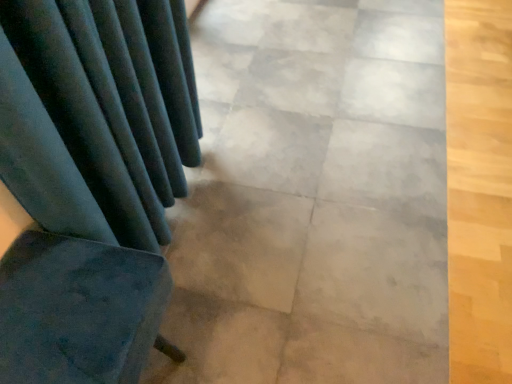
Measure the distance between gray concrete at center and camera.

gray concrete at center and camera are 1.16 meters apart from each other.

Describe the element at coordinates (314, 198) in the screenshot. I see `gray concrete at center` at that location.

This screenshot has height=384, width=512. I want to click on gray concrete at center, so click(x=314, y=198).

In order to click on gray concrete at center in this screenshot , I will do `click(314, 198)`.